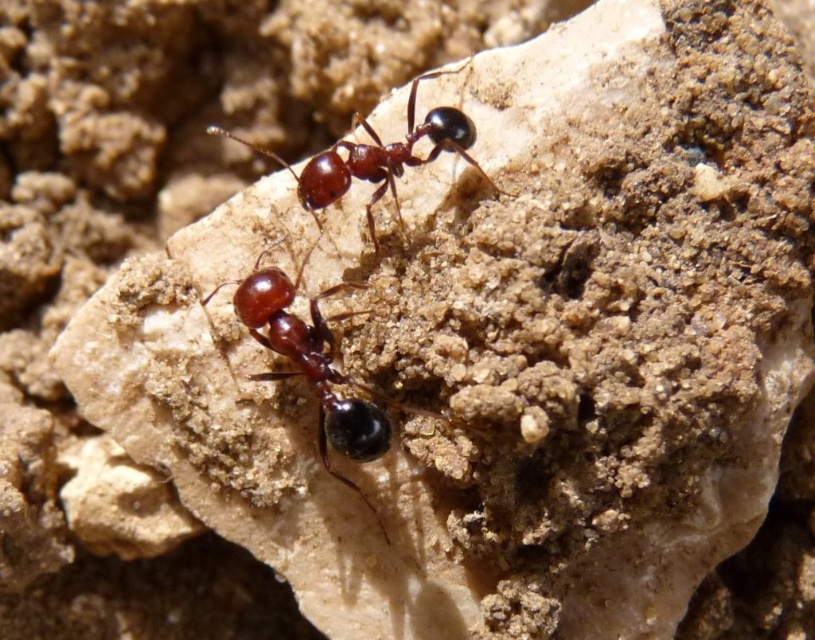
You are observing two ants on a rock. The ants are labeled as the shiny brown ant at center and the shiny brown ant at upper center. Which ant is positioned lower on the rock?

The shiny brown ant at center is positioned below the shiny brown ant at upper center, so it is lower on the rock.

You are observing two ants on a rock. You notice a shiny brown ant at center and a shiny brown ant at upper center. Which ant is positioned closer to you?

The shiny brown ant at center is closer to the viewer than the shiny brown ant at upper center.

You are observing two ants on a rock. You see a point labeled as point (315, 364). Which object is this point located on?

The point (315, 364) is located on the shiny brown ant at center.